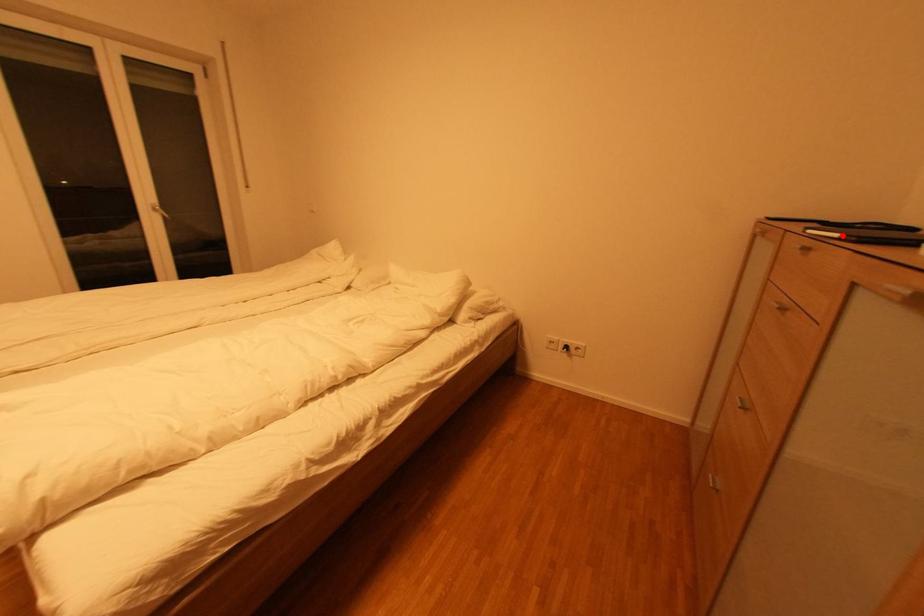
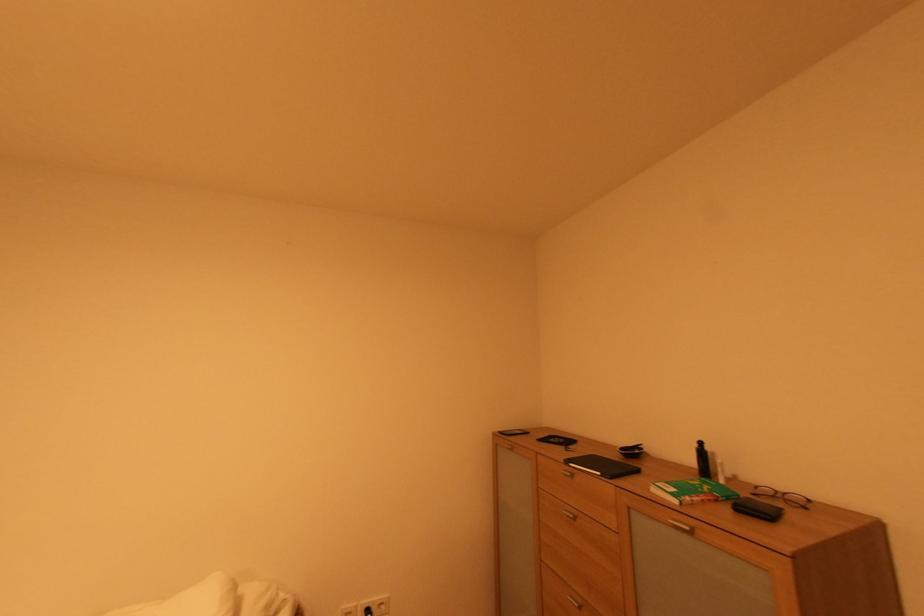
Locate, in the second image, the point that corresponds to the highlighted location in the first image.

(604, 475)